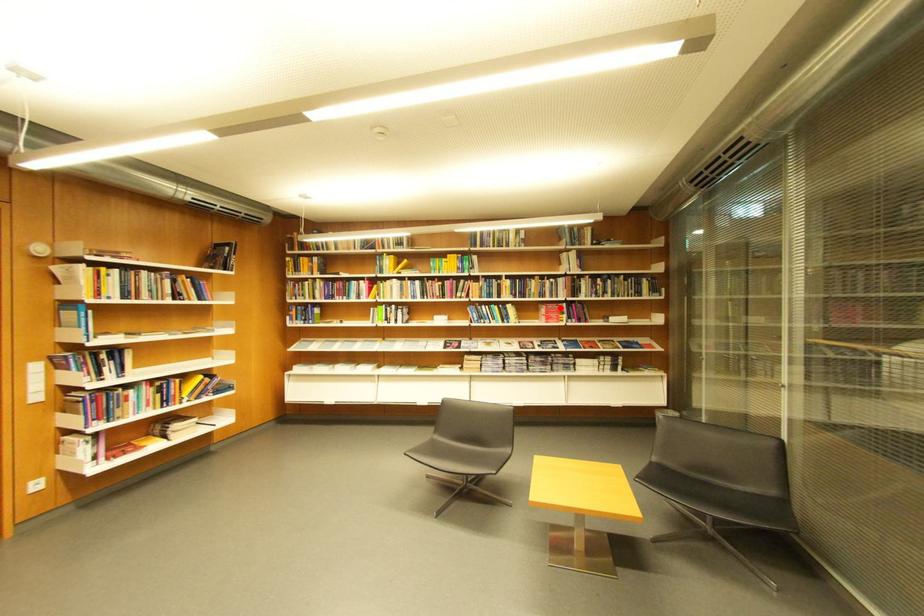
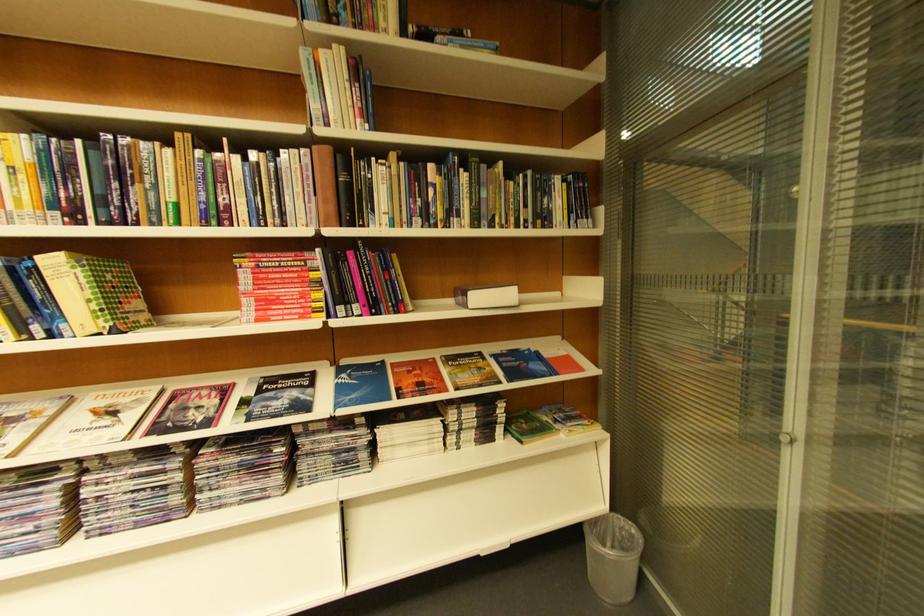
Where in the second image is the point corresponding to the highlighted location from the first image?

(281, 262)